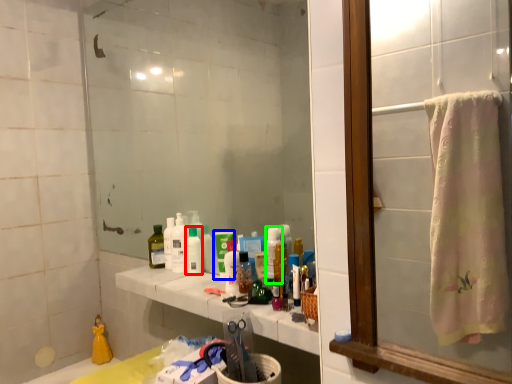
Question: Which object is the closest to the mouthwash (highlighted by a red box)? Choose among these: mouthwash (highlighted by a blue box) or cleaning product (highlighted by a green box).

Choices:
 (A) mouthwash
 (B) cleaning product

Answer: (A)